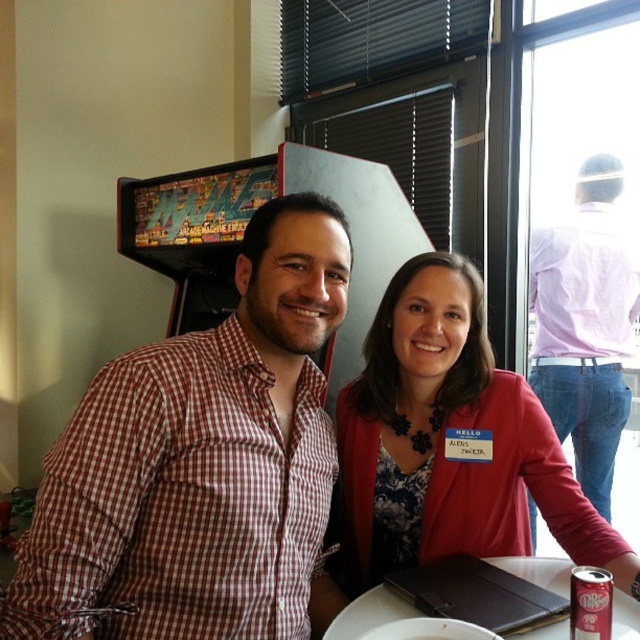
You are a tailor who needs to determine if the matte pink blazer at center can be folded and placed into the white glossy plate at center. Based on their sizes, what would you advise?

The matte pink blazer at center is larger in size than the white glossy plate at center, so it cannot be folded and placed into the plate.